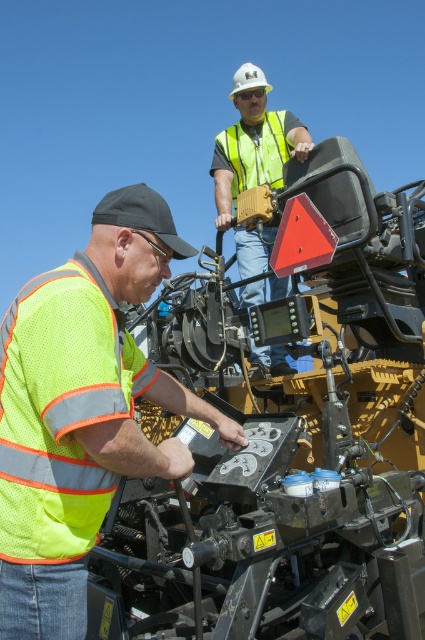
Question: Which point is farther to the camera?

Choices:
 (A) neon yellow safety vest at lower left
 (B) high-visibility reflective vest at upper center
 (C) neon yellow mesh safety vest at left

Answer: (B)

Question: Which point appears closest to the camera in this image?

Choices:
 (A) (172, 396)
 (B) (129, 397)
 (C) (275, 154)
 (D) (263, 164)

Answer: (B)

Question: Can you confirm if neon yellow safety vest at lower left is positioned above neon yellow mesh safety vest at left?

Choices:
 (A) yes
 (B) no

Answer: (B)

Question: Observing the image, what is the correct spatial positioning of high-visibility reflective vest at upper center in reference to high-visibility reflective safety vest at upper center?

Choices:
 (A) below
 (B) above

Answer: (A)

Question: Which object is farther from the camera taking this photo?

Choices:
 (A) high-visibility reflective safety vest at upper center
 (B) neon yellow safety vest at lower left
 (C) high-visibility reflective vest at upper center
 (D) neon yellow mesh safety vest at left

Answer: (A)

Question: Does neon yellow mesh safety vest at left have a greater width compared to high-visibility reflective safety vest at upper center?

Choices:
 (A) no
 (B) yes

Answer: (A)